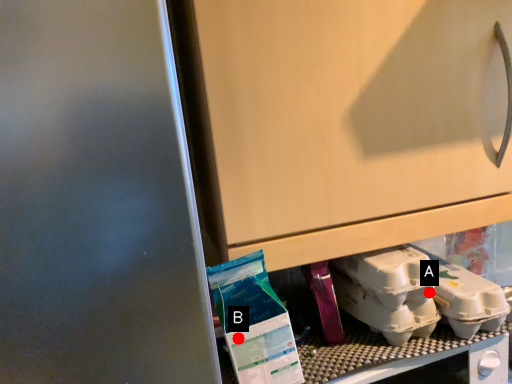
Question: Two points are circled on the image, labeled by A and B beside each circle. Which point is further to the camera?

Choices:
 (A) A is further
 (B) B is further

Answer: (A)